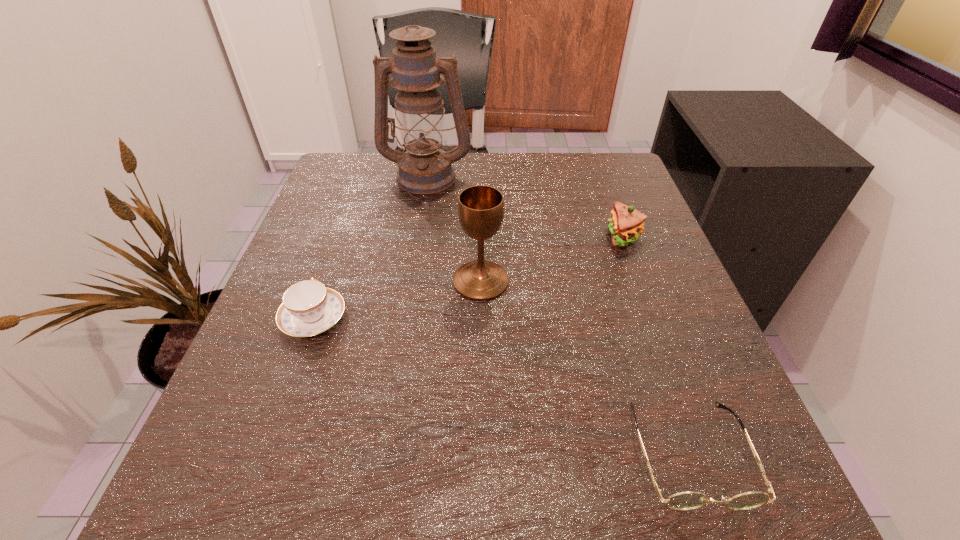
At what (x,y) coordinates should I click in order to perform the action: click on object that is the fourth nearest to the sandwich. Please return your answer as a coordinate pair (x, y). This screenshot has height=540, width=960. Looking at the image, I should click on (309, 308).

Identify the location of blank space that satisfies the following two spatial constraints: 1. on the side with the handle of the second farthest object; 2. on the right side of the fourth tallest object. The width and height of the screenshot is (960, 540). (343, 237).